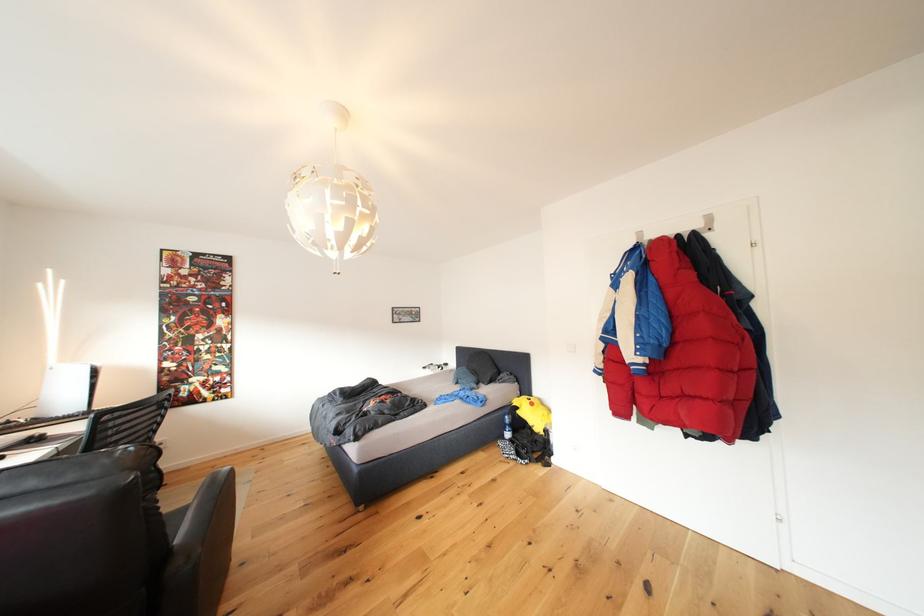
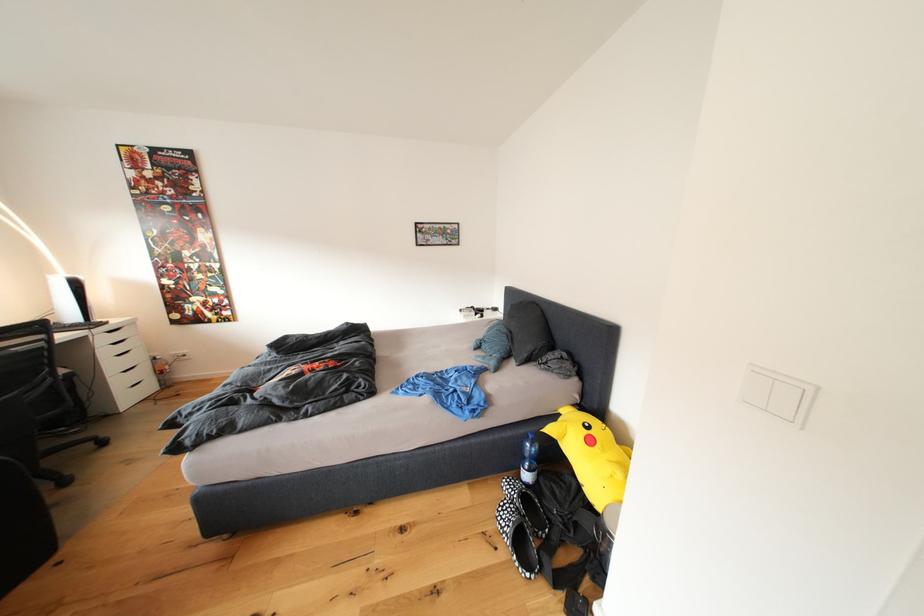
Find the pixel in the second image that matches (x=513, y=424) in the first image.

(531, 451)